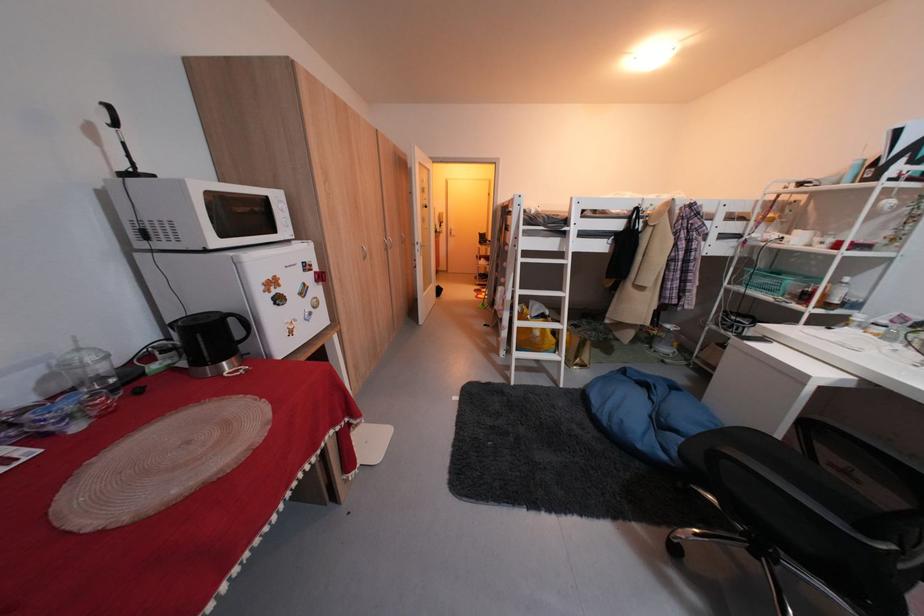
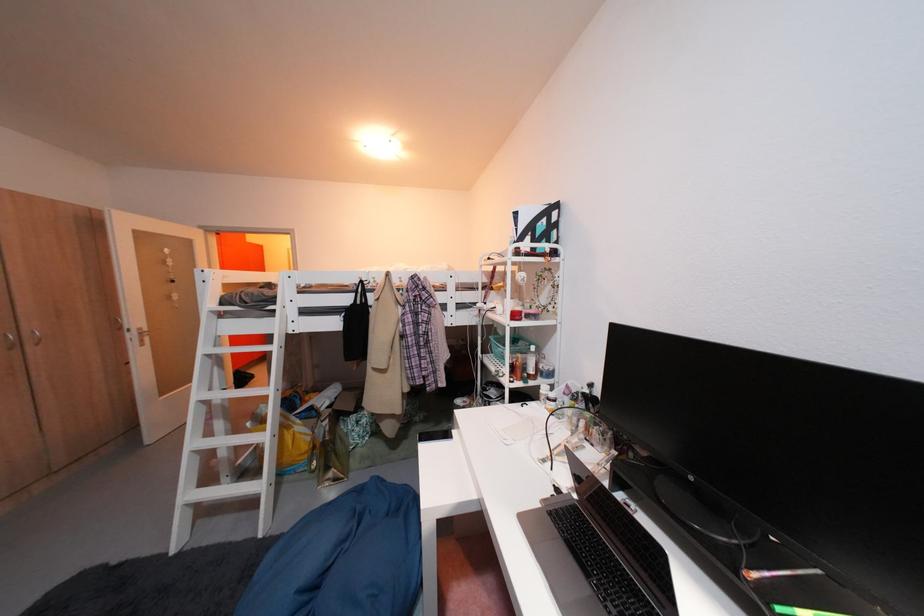
The point at (567, 222) is marked in the first image. Where is the corresponding point in the second image?

(276, 300)